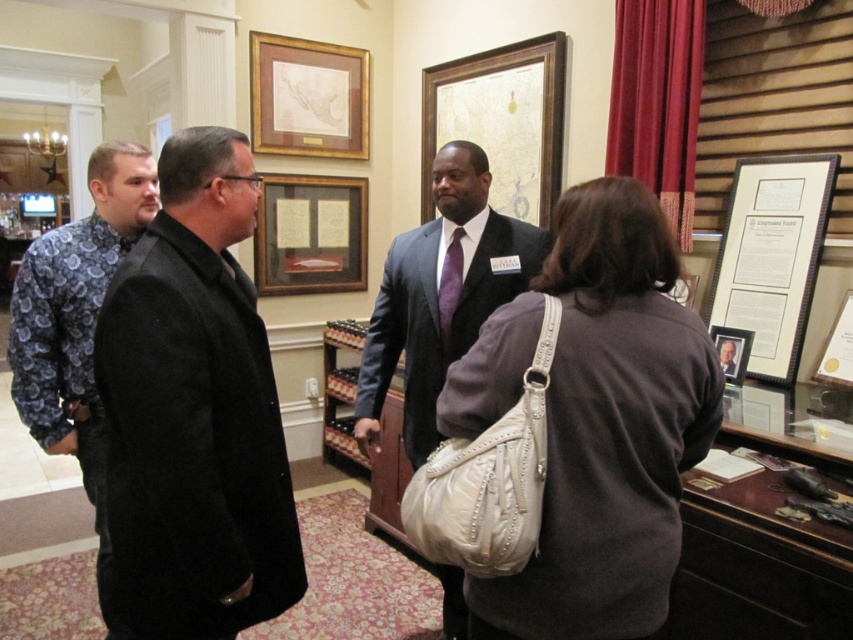
Question: Considering the real-world distances, which object is farthest from the gold-framed map at upper center?

Choices:
 (A) matte black frame at center
 (B) matte white purse at center

Answer: (B)

Question: Among these points, which one is nearest to the camera?

Choices:
 (A) (271, 145)
 (B) (326, 346)
 (C) (676, 529)

Answer: (C)

Question: Can you confirm if matte gold picture frame at right is positioned below matte black frame at center?

Choices:
 (A) yes
 (B) no

Answer: (B)

Question: Does gold-framed map at upper center have a larger size compared to wooden frame at center?

Choices:
 (A) yes
 (B) no

Answer: (B)

Question: Is patterned fabric shirt at left positioned before matte gold picture frame at right?

Choices:
 (A) yes
 (B) no

Answer: (A)

Question: Which point is closer to the camera?

Choices:
 (A) wooden framed map at center
 (B) matte gold picture frame at right
 (C) black wool coat at center
 (D) dark gray suit at center

Answer: (C)